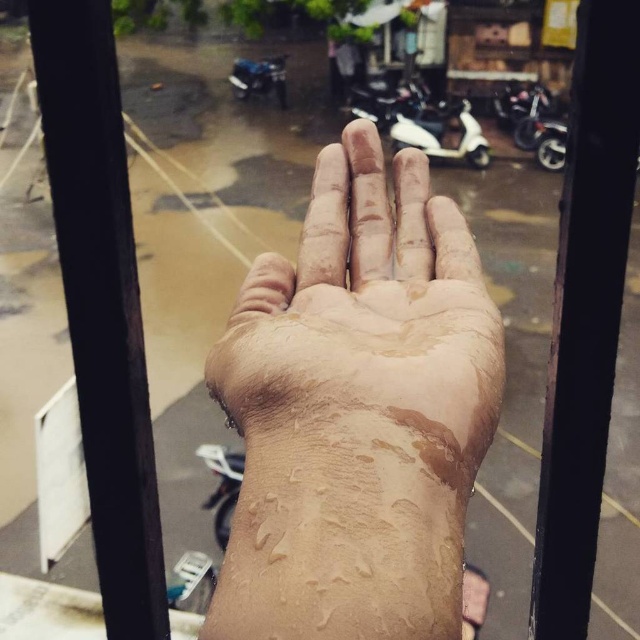
You are a photographer trying to capture the reflection of the blue metallic motorcycle at upper center in the wet hand. Based on the scene, can you see the motorcycle reflected in the dry skin at center?

The dry skin at center is in front of the blue metallic motorcycle at upper center, so the motorcycle cannot be reflected in the dry skin because the skin is blocking the view.

You are a delivery person who needs to check if the dry skin at center is closer to the window than the blue metallic motorcycle at upper center. Based on the scene, can you determine this?

The dry skin at center is to the right of the blue metallic motorcycle at upper center, but their positions relative to the window cannot be determined from the description provided.

You are standing on a balcony and see two points through the window. The first point is at position point (433, 273) and the second point is at position point (442, 136). Which point is closer to you?

Point (433, 273) is in front of point (442, 136), so the first point is closer to you.